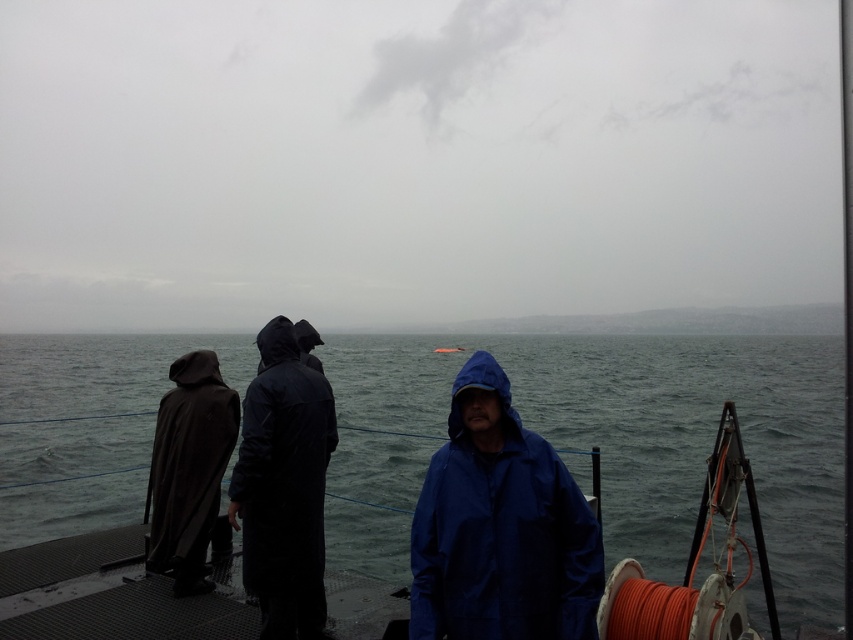
Question: Is gray water at center in front of dark matte raincoat at center?

Choices:
 (A) yes
 (B) no

Answer: (B)

Question: Which object is the closest to the blue waterproof jacket at center?

Choices:
 (A) gray matte water at center
 (B) dark matte trench coat at left
 (C) gray water at center

Answer: (B)

Question: Does blue waterproof jacket at center appear on the right side of dark matte trench coat at left?

Choices:
 (A) yes
 (B) no

Answer: (A)

Question: Among these points, which one is farthest from the camera?

Choices:
 (A) (225, 419)
 (B) (314, 483)
 (C) (537, 500)
 (D) (486, 332)

Answer: (D)

Question: Which point is closer to the camera?

Choices:
 (A) 167,324
 (B) 345,557
 (C) 201,416
 (D) 460,468

Answer: (D)

Question: Does blue waterproof jacket at center have a greater width compared to gray matte water at center?

Choices:
 (A) no
 (B) yes

Answer: (A)